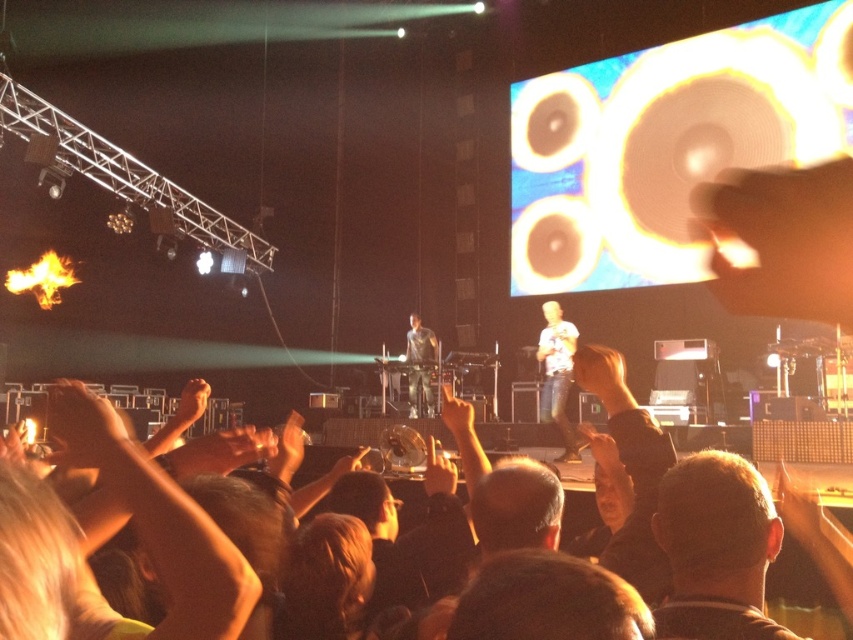
You are a photographer at the concert. You want to take a clear photo of the white cotton shirt at center from your current position. Considering the typical focus range of a camera lens is 5 meters, will you be able to capture it clearly?

The white cotton shirt at center is 7.40 meters away from the camera, which exceeds the typical focus range of 5 meters. Therefore, you may not be able to capture it clearly without adjusting your position or using specialized equipment.

You are a photographer at the concert. You want to take a photo of both the white cotton shirt at center and the dark gray shirt at center. Which one should you focus on first to ensure both are in focus?

You should focus on the white cotton shirt at center first because it is closer to the viewer than the dark gray shirt at center, so by focusing on the closer one, both will be in focus.

You are a photographer at the concert and want to capture both the white cotton shirt at center and the dark gray shirt at center in a single shot. Since you want both shirts to be clearly visible, which shirt should you focus on to ensure the taller one is in focus?

The white cotton shirt at center is much taller as dark gray shirt at center. Therefore, you should focus on the white cotton shirt at center to ensure the taller one is in focus.